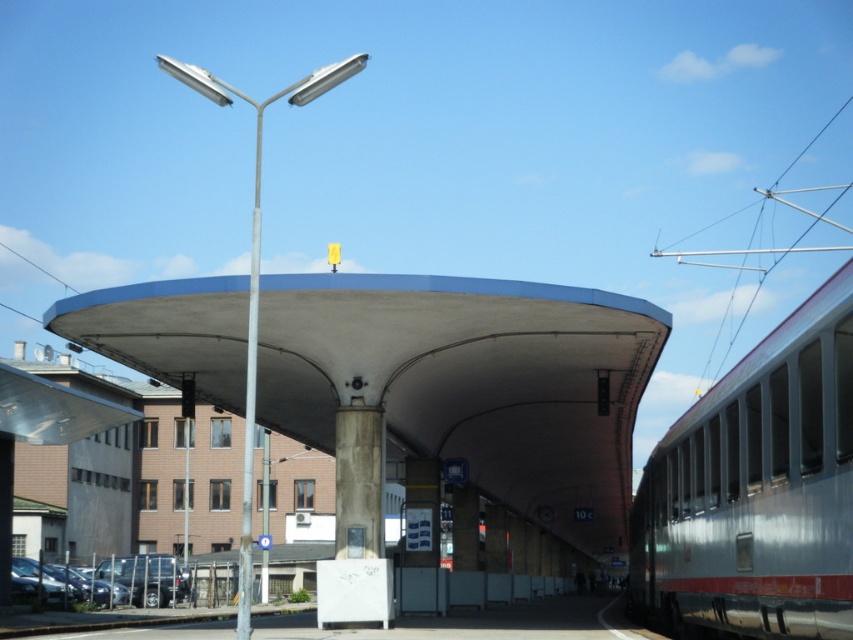
You are standing on the platform and want to board the silver metallic train at right. Which direction should you walk relative to the metallic pole at left?

You should walk to the right of the metallic pole at left because the silver metallic train at right is located to the right of the metallic pole at left.

You are standing at the train station platform and want to reach a specific point marked at coordinates point (238, 321). If your walking speed is 1.5 meters per second, how many seconds will it take you to reach that point from your current position?

The distance of point (238, 321) from camera is 22.33 meters. At a speed of 1.5 meters per second, it will take approximately 14.89 seconds to reach the point.